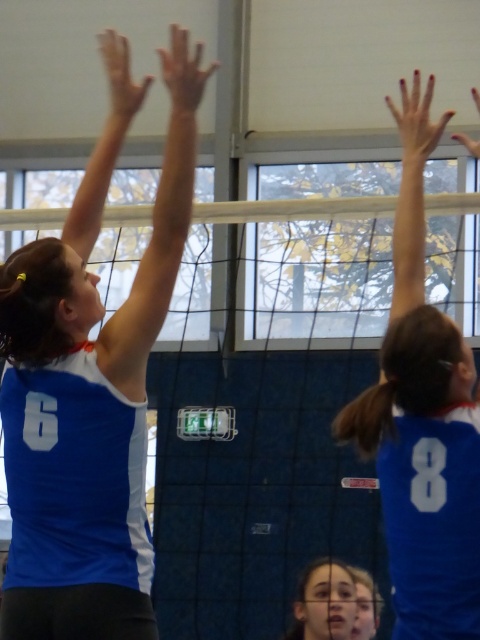
Question: Can you confirm if white mesh net at center is positioned above blue jersey at upper right?

Choices:
 (A) no
 (B) yes

Answer: (B)

Question: Does blue jersey at upper left appear over blue jersey at upper right?

Choices:
 (A) no
 (B) yes

Answer: (B)

Question: Which of the following is the closest to the observer?

Choices:
 (A) blue jersey at upper right
 (B) white mesh net at center
 (C) blue jersey at upper left

Answer: (A)

Question: Which point is closer to the camera taking this photo?

Choices:
 (A) (160, 563)
 (B) (40, 305)
 (C) (396, 538)

Answer: (C)

Question: Which of the following is the farthest from the observer?

Choices:
 (A) (456, 596)
 (B) (67, 600)
 (C) (186, 371)

Answer: (C)

Question: Is blue jersey at upper left smaller than blue jersey at upper right?

Choices:
 (A) no
 (B) yes

Answer: (A)